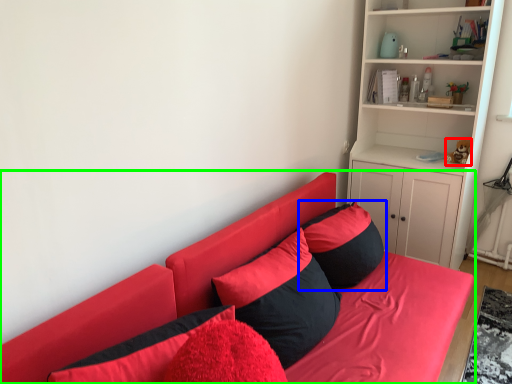
Question: Estimate the real-world distances between objects in this image. Which object is closer to toy (highlighted by a red box), pillow (highlighted by a blue box) or studio couch (highlighted by a green box)?

Choices:
 (A) pillow
 (B) studio couch

Answer: (A)